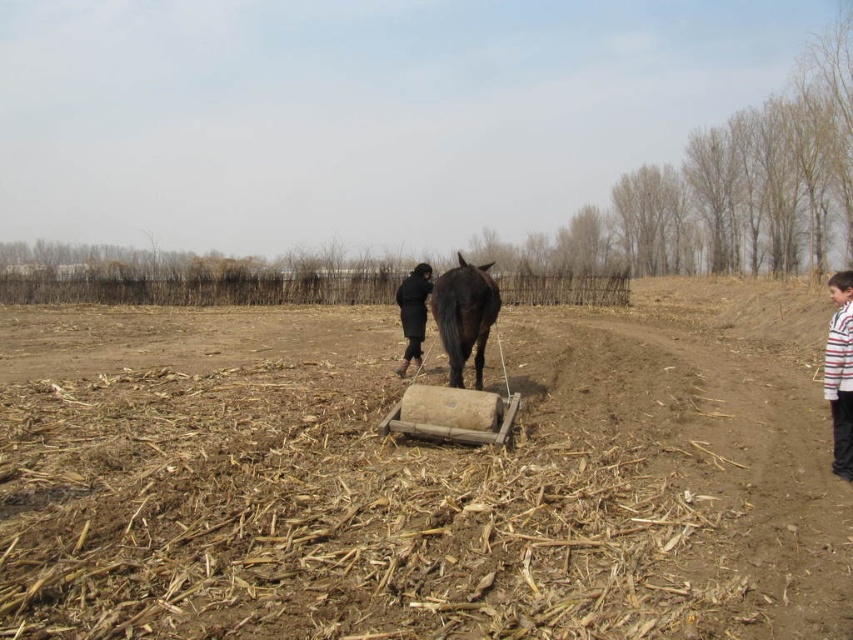
Does brown soil at center have a smaller size compared to wooden cart at center?

Incorrect, brown soil at center is not smaller in size than wooden cart at center.

Is point (350, 436) closer to camera compared to point (454, 428)?

No, (350, 436) is behind (454, 428).

Locate an element on the screen. The width and height of the screenshot is (853, 640). brown soil at center is located at coordinates (422, 476).

Who is more distant from viewer, (479, 300) or (405, 362)?

The point (405, 362) is behind.

Does black glossy horse at center have a lesser width compared to black matte coat at center?

No, black glossy horse at center is not thinner than black matte coat at center.

Identify the location of black glossy horse at center. This screenshot has width=853, height=640. (463, 316).

You are a GUI agent. You are given a task and a screenshot of the screen. Output one action in this format:
    pyautogui.click(x=<x>, y=<y>)
    Task: Click on the black glossy horse at center
    This screenshot has height=640, width=853.
    Given the screenshot: What is the action you would take?
    pyautogui.click(x=463, y=316)

How far apart are brown soil at center and black glossy horse at center?

brown soil at center is 17.61 feet away from black glossy horse at center.

What do you see at coordinates (422, 476) in the screenshot? This screenshot has width=853, height=640. I see `brown soil at center` at bounding box center [422, 476].

Locate an element on the screen. brown soil at center is located at coordinates (422, 476).